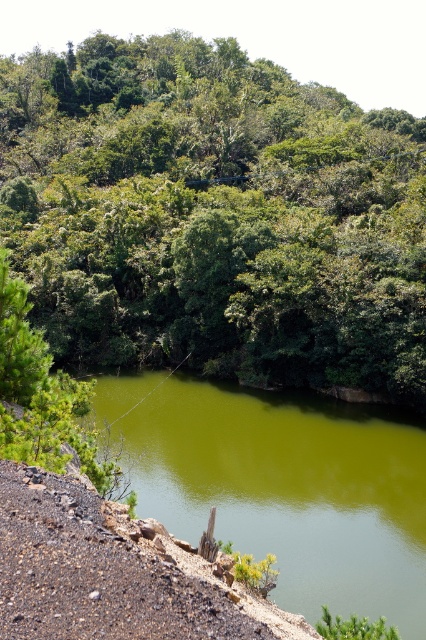
Question: Does green leafy tree at upper center have a lesser width compared to green smooth water at center?

Choices:
 (A) no
 (B) yes

Answer: (A)

Question: Can you confirm if green leafy tree at upper center is positioned to the right of green smooth water at center?

Choices:
 (A) yes
 (B) no

Answer: (B)

Question: Which object appears closest to the camera in this image?

Choices:
 (A) green smooth water at center
 (B) green leafy tree at upper center

Answer: (A)

Question: In this image, where is green leafy tree at upper center located relative to green smooth water at center?

Choices:
 (A) right
 (B) left

Answer: (B)

Question: Which point is farther to the camera?

Choices:
 (A) green smooth water at center
 (B) green leafy tree at upper center

Answer: (B)